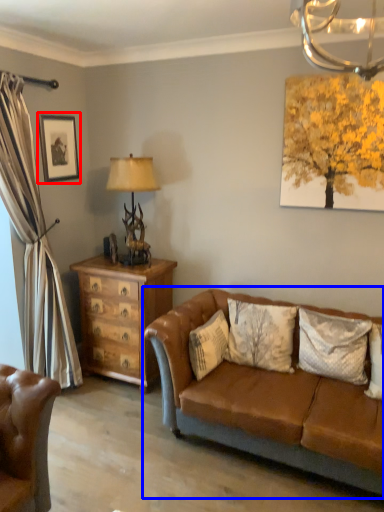
Question: Which point is closer to the camera, picture frame (highlighted by a red box) or studio couch (highlighted by a blue box)?

Choices:
 (A) picture frame
 (B) studio couch

Answer: (B)